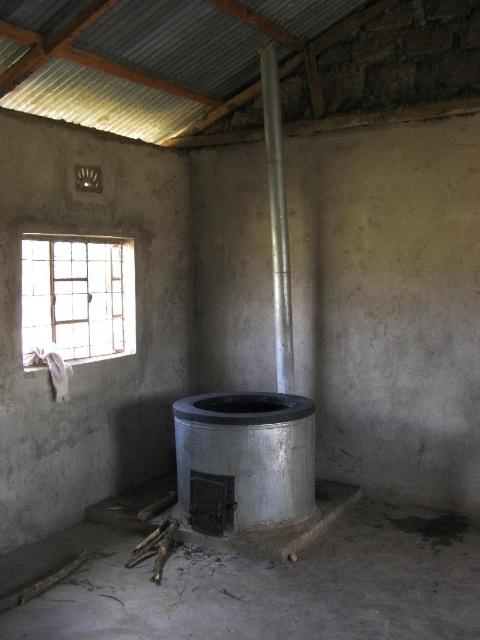
Is point (95, 330) positioned behind point (285, 378)?

Yes, it is behind point (285, 378).

Can you confirm if clear glass window at upper left is shorter than silver metallic chimney at center?

Correct, clear glass window at upper left is not as tall as silver metallic chimney at center.

Does point (27, 314) lie behind point (284, 364)?

No, (27, 314) is closer to viewer.

At what (x,y) coordinates should I click in order to perform the action: click on clear glass window at upper left. Please return your answer as a coordinate pair (x, y). The height and width of the screenshot is (640, 480). Looking at the image, I should click on (78, 296).